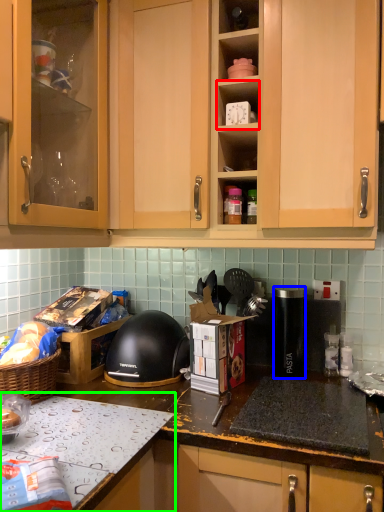
Question: Estimate the real-world distances between objects in this image. Which object is closer to shelf (highlighted by a red box), kitchen appliance (highlighted by a blue box) or countertop (highlighted by a green box)?

Choices:
 (A) kitchen appliance
 (B) countertop

Answer: (A)